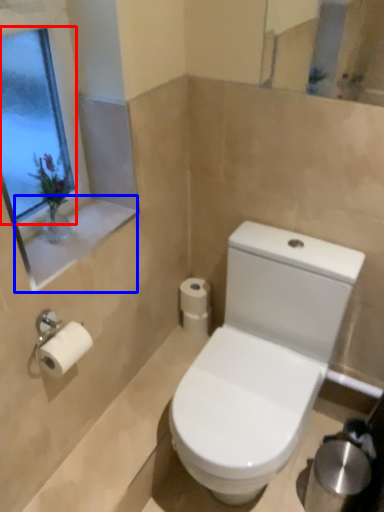
Question: Among these objects, which one is nearest to the camera, window screen (highlighted by a red box) or window sill (highlighted by a blue box)?

Choices:
 (A) window screen
 (B) window sill

Answer: (A)